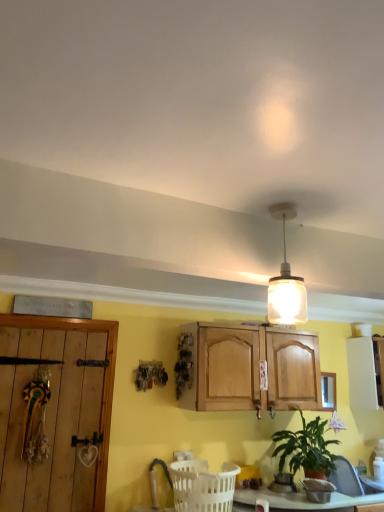
Question: Is white plastic basket at lower center thinner than green matte plant at lower right?

Choices:
 (A) no
 (B) yes

Answer: (B)

Question: Is white plastic basket at lower center facing away from green matte plant at lower right?

Choices:
 (A) no
 (B) yes

Answer: (A)

Question: Is white plastic basket at lower center taller than green matte plant at lower right?

Choices:
 (A) no
 (B) yes

Answer: (A)

Question: Is white plastic basket at lower center outside green matte plant at lower right?

Choices:
 (A) no
 (B) yes

Answer: (B)

Question: From a real-world perspective, is white plastic basket at lower center physically below green matte plant at lower right?

Choices:
 (A) no
 (B) yes

Answer: (B)

Question: Which is correct: translucent glass pendant light at upper center is inside white plastic basket at lower center, or outside of it?

Choices:
 (A) outside
 (B) inside

Answer: (A)

Question: Looking at the image, does translucent glass pendant light at upper center seem bigger or smaller compared to white plastic basket at lower center?

Choices:
 (A) big
 (B) small

Answer: (B)

Question: From the image's perspective, is translucent glass pendant light at upper center above or below white plastic basket at lower center?

Choices:
 (A) above
 (B) below

Answer: (A)

Question: Looking at their shapes, would you say translucent glass pendant light at upper center is wider or thinner than white plastic basket at lower center?

Choices:
 (A) wide
 (B) thin

Answer: (B)

Question: Considering the positions of translucent glass pendant light at upper center and clear glass window at upper right in the image, is translucent glass pendant light at upper center bigger or smaller than clear glass window at upper right?

Choices:
 (A) small
 (B) big

Answer: (B)

Question: In terms of height, does translucent glass pendant light at upper center look taller or shorter compared to clear glass window at upper right?

Choices:
 (A) short
 (B) tall

Answer: (B)

Question: Is point (288, 311) positioned closer to the camera than point (322, 382)?

Choices:
 (A) farther
 (B) closer

Answer: (B)

Question: In terms of width, does translucent glass pendant light at upper center look wider or thinner when compared to clear glass window at upper right?

Choices:
 (A) thin
 (B) wide

Answer: (B)

Question: Is white matte cabinet at right taller or shorter than translucent glass pendant light at upper center?

Choices:
 (A) short
 (B) tall

Answer: (B)

Question: Considering the positions of point (367, 408) and point (302, 293), is point (367, 408) closer or farther from the camera than point (302, 293)?

Choices:
 (A) closer
 (B) farther

Answer: (B)